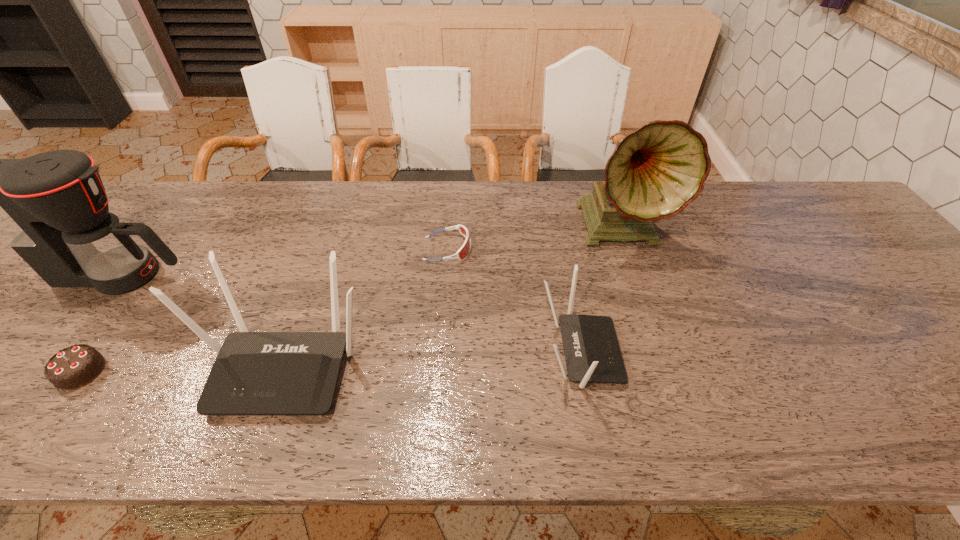
This screenshot has width=960, height=540. I want to click on free space for a new router on the right, so click(x=862, y=340).